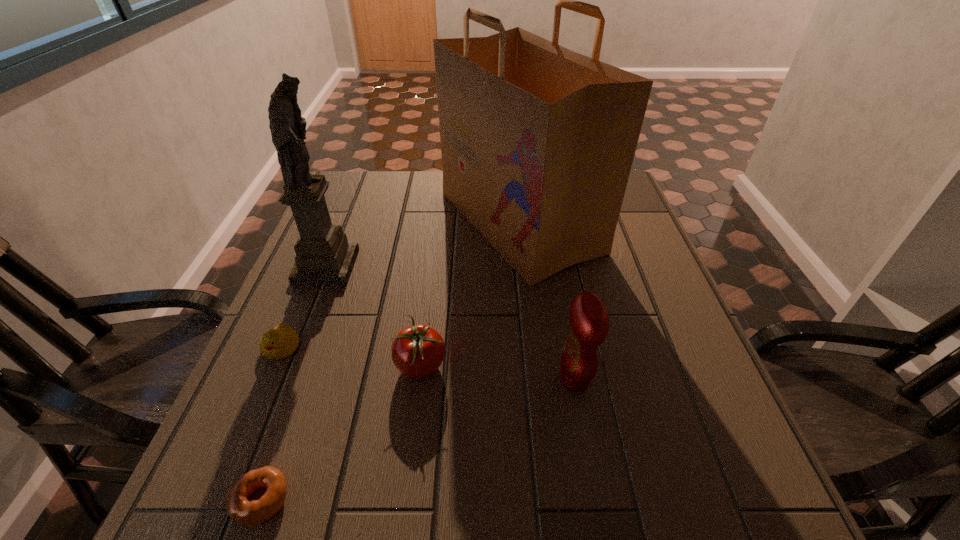
The width and height of the screenshot is (960, 540). Identify the location of free space between the doughnut and the grocery bag. pyautogui.click(x=390, y=361).

The image size is (960, 540). What are the coordinates of `unoccupied area between the nearest object and the second shortest object` in the screenshot? It's located at (271, 423).

Where is `free spot between the sculpture and the tomato`? This screenshot has height=540, width=960. free spot between the sculpture and the tomato is located at coordinates (373, 316).

Locate an element on the screen. Image resolution: width=960 pixels, height=540 pixels. free space that is in between the sculpture and the fourth shortest object is located at coordinates (450, 322).

You are a GUI agent. You are given a task and a screenshot of the screen. Output one action in this format:
    pyautogui.click(x=<x>, y=<y>)
    Task: Click on the unoccupied position between the sculpture and the grocery bag
    
    Given the screenshot: What is the action you would take?
    pyautogui.click(x=422, y=244)

This screenshot has width=960, height=540. What are the coordinates of `unoccupied area between the fifth shortest object and the duckling` in the screenshot? It's located at tap(303, 307).

Find the location of `free area in between the doughnut and the condiment`. free area in between the doughnut and the condiment is located at coordinates (418, 439).

Where is `blank region between the second shortest object and the third shortest object`? blank region between the second shortest object and the third shortest object is located at coordinates (350, 356).

The height and width of the screenshot is (540, 960). I want to click on vacant area that lies between the sculpture and the doughnut, so click(294, 383).

Select which object is the third closest to the sculpture. Please provide its 2D coordinates. Your answer should be formatted as a tuple, i.e. [(x, y)], where the tuple contains the x and y coordinates of a point satisfying the conditions above.

[(417, 351)]